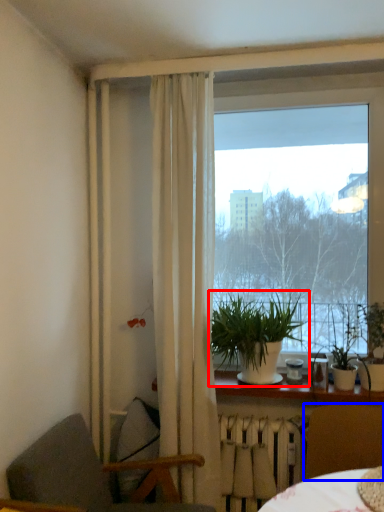
Question: Which of the following is the closest to the observer, houseplant (highlighted by a red box) or chair (highlighted by a blue box)?

Choices:
 (A) houseplant
 (B) chair

Answer: (B)